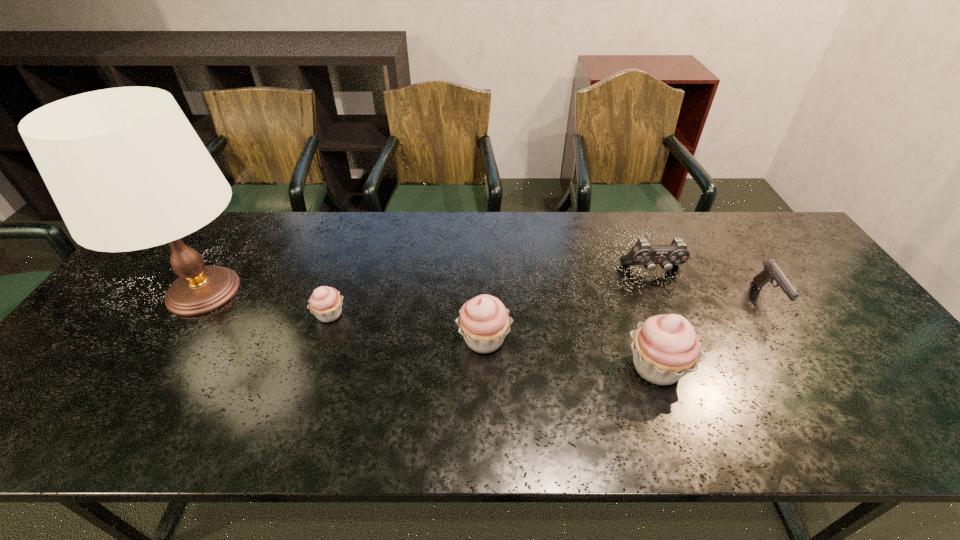
Image resolution: width=960 pixels, height=540 pixels. Identify the location of free space that is in between the shortest cupcake and the rightmost object. (x=548, y=306).

The width and height of the screenshot is (960, 540). Find the location of `vacant space that is in between the tallest object and the second object from left to right`. vacant space that is in between the tallest object and the second object from left to right is located at coordinates (267, 303).

The image size is (960, 540). Find the location of `free space between the pistol and the control`. free space between the pistol and the control is located at coordinates (709, 285).

Find the location of a particular element. The height and width of the screenshot is (540, 960). object identified as the closest to the rightmost cupcake is located at coordinates (642, 253).

Find the location of a particular element. The image size is (960, 540). the second closest object relative to the rightmost cupcake is located at coordinates (484, 321).

Select which cupcake appears as the closest to the rightmost cupcake. Please provide its 2D coordinates. Your answer should be formatted as a tuple, i.e. [(x, y)], where the tuple contains the x and y coordinates of a point satisfying the conditions above.

[(484, 321)]

Identify which cupcake is the second nearest to the control. Please provide its 2D coordinates. Your answer should be formatted as a tuple, i.e. [(x, y)], where the tuple contains the x and y coordinates of a point satisfying the conditions above.

[(484, 321)]

Where is `free point that satisfies the following two spatial constraints: 1. on the front side of the second tallest cupcake; 2. on the left side of the leftmost object`? The width and height of the screenshot is (960, 540). free point that satisfies the following two spatial constraints: 1. on the front side of the second tallest cupcake; 2. on the left side of the leftmost object is located at coordinates (174, 339).

Where is `free region that satisfies the following two spatial constraints: 1. on the front side of the rightmost cupcake; 2. on the left side of the second object from left to right`? This screenshot has height=540, width=960. free region that satisfies the following two spatial constraints: 1. on the front side of the rightmost cupcake; 2. on the left side of the second object from left to right is located at coordinates (312, 368).